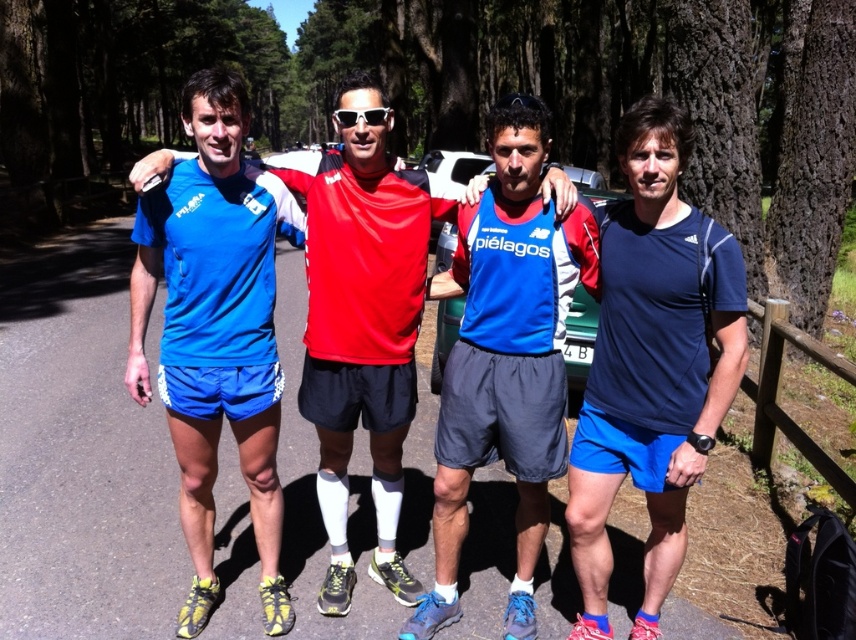
Question: Can you confirm if blue matte shorts at center is positioned above matte blue shorts at center?

Choices:
 (A) yes
 (B) no

Answer: (A)

Question: Among these points, which one is nearest to the camera?

Choices:
 (A) (667, 76)
 (B) (337, 240)
 (C) (645, 464)
 (D) (455, 435)

Answer: (C)

Question: Which of the following is the closest to the observer?

Choices:
 (A) navy blue fabric shirt at right
 (B) blue fabric shirt at center
 (C) matte blue shorts at center

Answer: (A)

Question: Can you confirm if matte blue shorts at center is positioned below sunglasses at center?

Choices:
 (A) no
 (B) yes

Answer: (B)

Question: Among these objects, which one is farthest from the camera?

Choices:
 (A) smooth bark tree at right
 (B) blue matte shorts at center
 (C) sunglasses at center
 (D) smooth bark tree at center

Answer: (A)

Question: Where is blue matte shorts at center located in relation to blue fabric shirt at center in the image?

Choices:
 (A) below
 (B) above

Answer: (B)